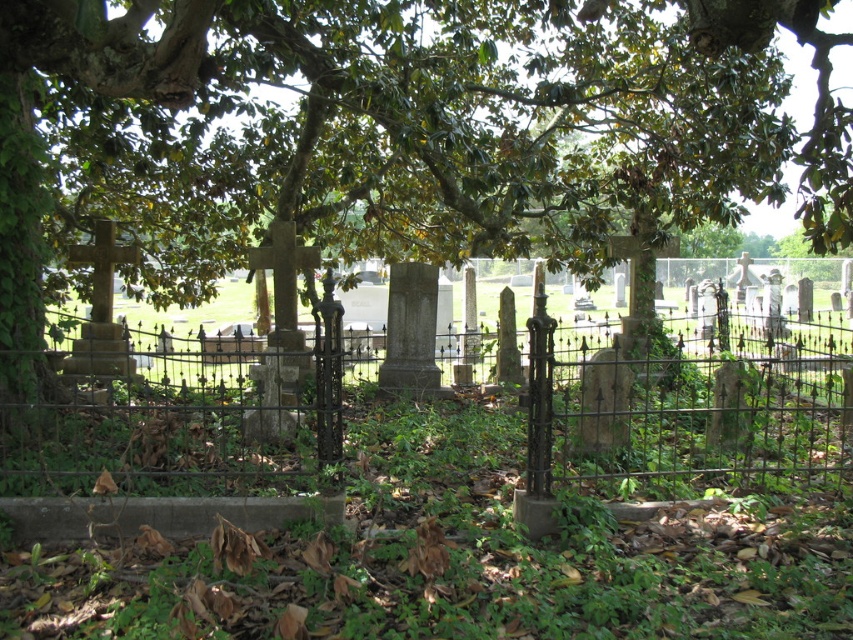
You are standing at the entrance of the cemetery and want to take a photo of the green leafy tree at center. Based on your current position, is the tree positioned to the left or right side of the image?

The green leafy tree at center is located at point coordinates that place it centrally within the image, so it is neither to the left nor right but in the middle.

You are standing in front of the cemetery and notice the green leafy tree at center and the rusty iron fence at center. Which object is nearer to you?

The green leafy tree at center is closer to the viewer than the rusty iron fence at center, so the green leafy tree at center is nearer to you.